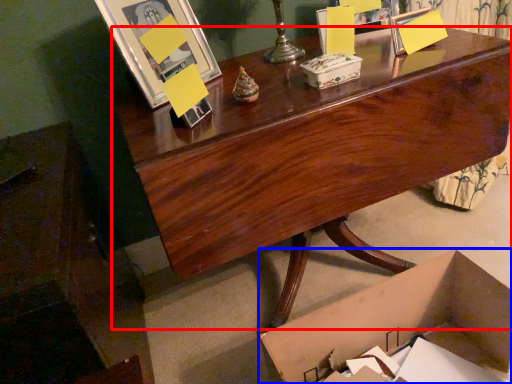
Question: Among these objects, which one is farthest to the camera, desk (highlighted by a red box) or box (highlighted by a blue box)?

Choices:
 (A) desk
 (B) box

Answer: (A)